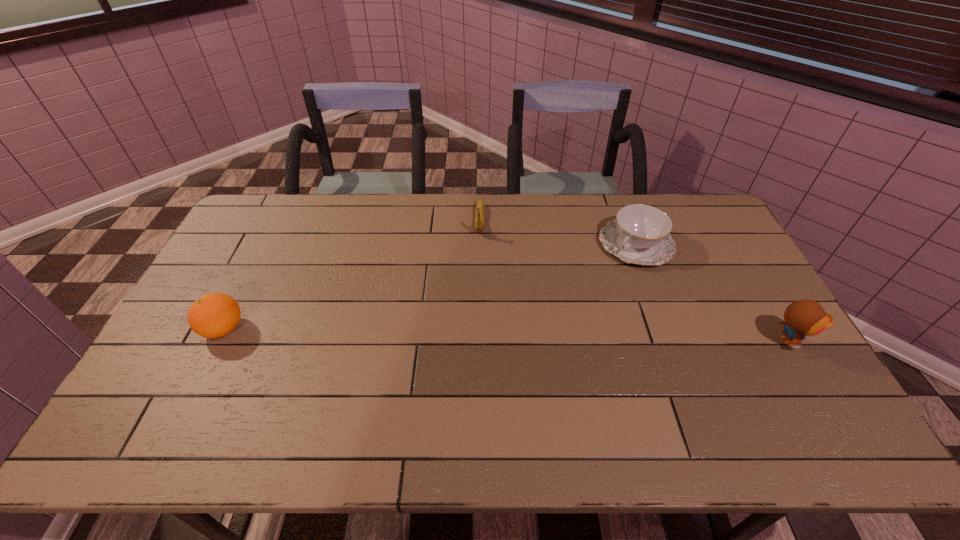
Locate an element on the screen. Image resolution: width=960 pixels, height=540 pixels. free space between the banana and the duck is located at coordinates (636, 281).

The width and height of the screenshot is (960, 540). I want to click on free spot between the rightmost object and the orange, so click(x=507, y=335).

The height and width of the screenshot is (540, 960). I want to click on empty space between the chinaware and the leftmost object, so click(430, 287).

Find the location of `free space between the rightmost object and the leftmost object`. free space between the rightmost object and the leftmost object is located at coordinates (507, 335).

This screenshot has height=540, width=960. I want to click on vacant area that lies between the third object from right to left and the tallest object, so click(636, 281).

This screenshot has height=540, width=960. Find the location of `vacant space that is in between the orange and the second object from right to left`. vacant space that is in between the orange and the second object from right to left is located at coordinates (430, 287).

You are a GUI agent. You are given a task and a screenshot of the screen. Output one action in this format:
    pyautogui.click(x=<x>, y=<y>)
    Task: Click on the free space between the banana and the second object from right to left
    
    Given the screenshot: What is the action you would take?
    pyautogui.click(x=558, y=232)

Where is `empty space that is in between the third object from right to left and the tallest object`? empty space that is in between the third object from right to left and the tallest object is located at coordinates (636, 281).

Identify the location of free spot between the banana and the leftmost object. The height and width of the screenshot is (540, 960). (351, 275).

The width and height of the screenshot is (960, 540). Identify the location of vacant region between the rightmost object and the chinaware. (713, 293).